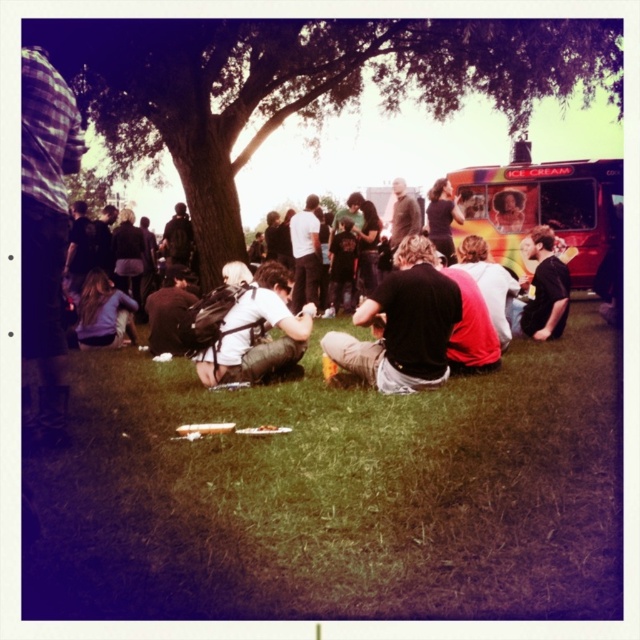
You are a photographer trying to capture a photo of the rainbow painted ice cream truck at right and the red shirt at center. Since you want both subjects to be clearly visible, which one should you focus on first to ensure depth of field?

The rainbow painted ice cream truck at right is taller than the red shirt at center, so you should focus on the rainbow painted ice cream truck at right first to ensure both are in focus.